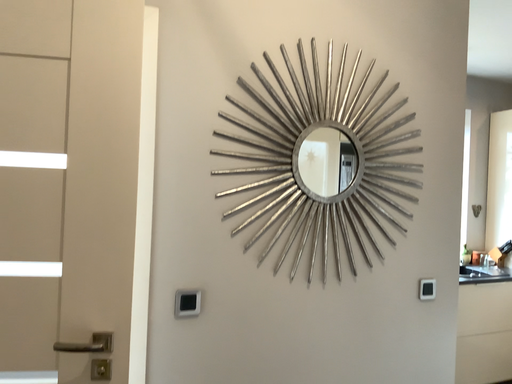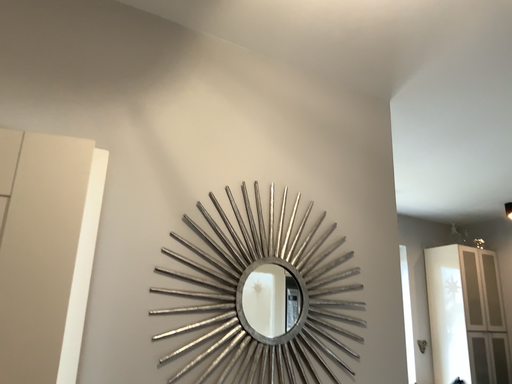
Question: How did the camera likely rotate when shooting the video?

Choices:
 (A) rotated left
 (B) rotated right

Answer: (B)